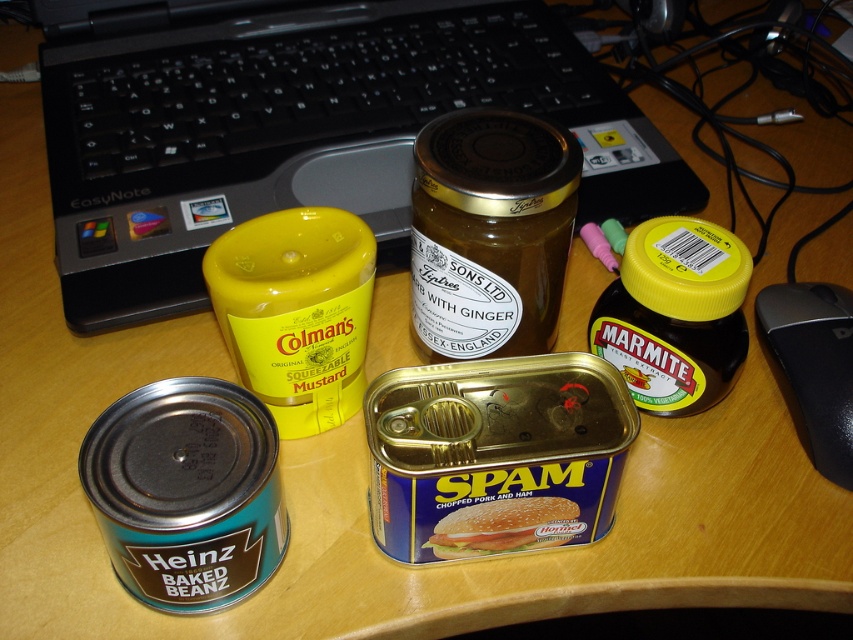
What are the coordinates of the black plastic laptop at upper left?

The black plastic laptop at upper left is located at coordinates point (305, 132).

From the picture: You have a small box that can only hold items narrower than the black plastic mouse at right. Can you safely place the gold glass jar of ginger at center into the box?

The gold glass jar of ginger at center might be wider than the black plastic mouse at right, so it may not fit in the box. Check the width before placing it.